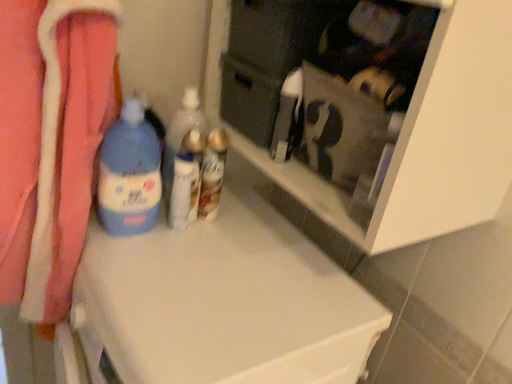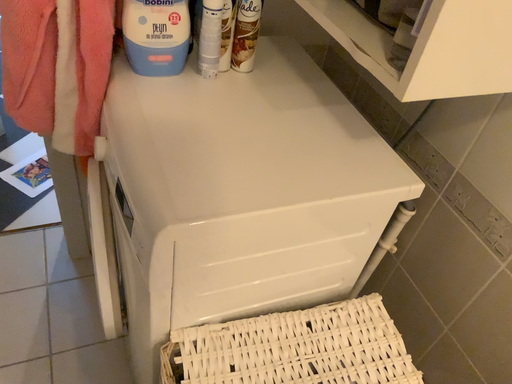
Question: Which way did the camera rotate in the video?

Choices:
 (A) rotated right
 (B) rotated left

Answer: (B)